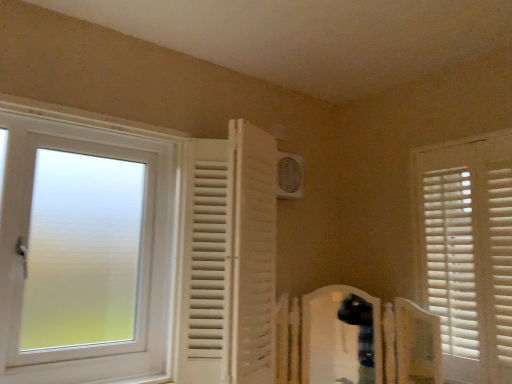
Question: Is point (419, 296) positioned closer to the camera than point (45, 132)?

Choices:
 (A) farther
 (B) closer

Answer: (A)

Question: Looking at their shapes, would you say white wooden blinds at right, which is the first window from right to left, is wider or thinner than white frosted glass window at left, which is the second window in right-to-left order?

Choices:
 (A) thin
 (B) wide

Answer: (A)

Question: Based on their relative distances, which object is farther from the white plastic air conditioning unit at upper center?

Choices:
 (A) white wooden blinds at right, which ranks as the second window in left-to-right order
 (B) white frosted glass window at left, which is the second window in right-to-left order

Answer: (A)

Question: Estimate the real-world distances between objects in this image. Which object is farther from the white plastic air conditioning unit at upper center?

Choices:
 (A) white frosted glass window at left, which is the second window in right-to-left order
 (B) white wooden blinds at right, which ranks as the second window in left-to-right order

Answer: (B)